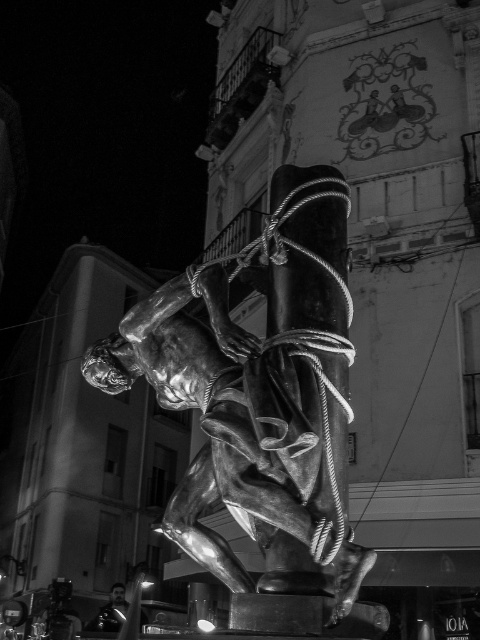
You are standing in front of the statue and want to know how far you are from the point marked at coordinates point [265,234]. Can you determine the distance?

The point [265,234] is 79.77 feet away from the camera, so you are approximately 79.77 feet away from the point marked at coordinates point [265,234].

You are an art restorer working on a sculpture. You need to clean both the shiny bronze statue at center and the shiny black helmet at lower left. Which object should you start with if you want to work on the one closer to you first?

The shiny bronze statue at center is in front of the shiny black helmet at lower left, so you should start with the shiny bronze statue at center since it is closer to you.